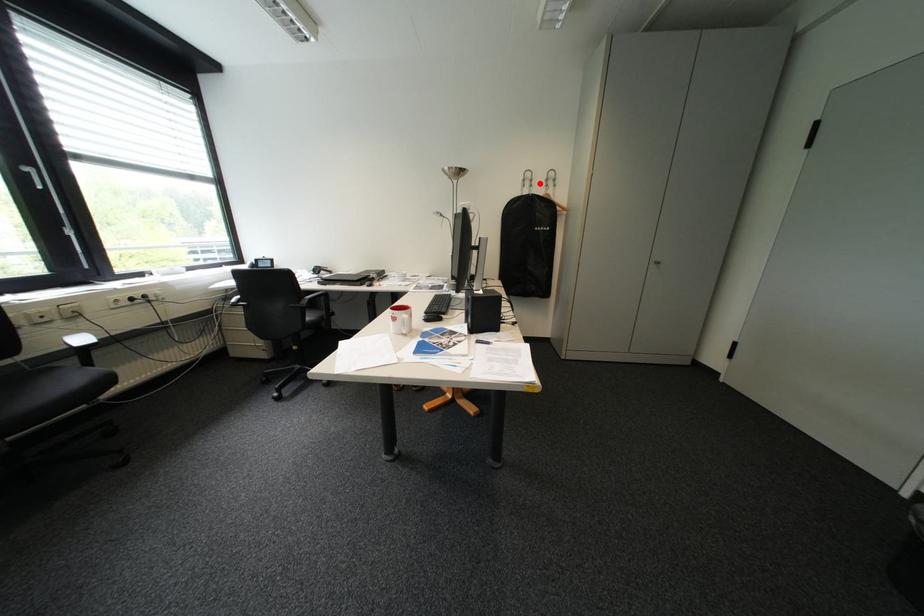
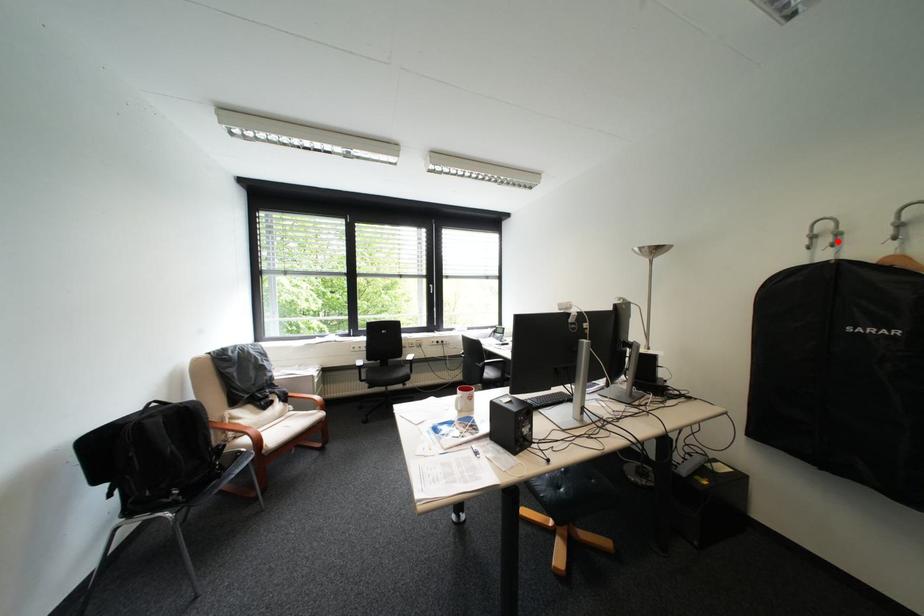
I am providing you with two images of the same scene from different viewpoints. A red point is marked on the first image and another point is marked on the second image. Is the marked point in image1 the same physical position as the marked point in image2?

Yes